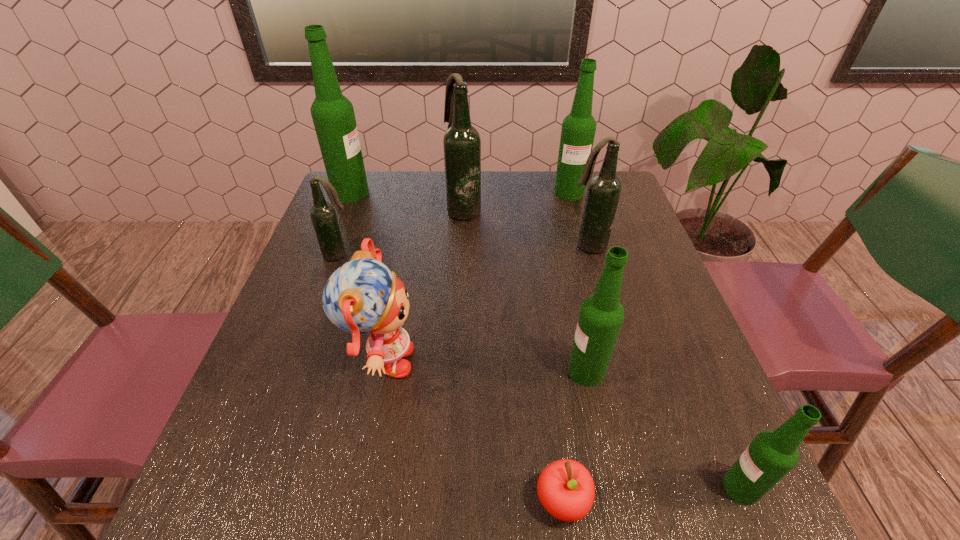
Locate an element on the screen. This screenshot has width=960, height=540. vacant space located on the label of the second nearest beer bottle is located at coordinates (454, 371).

Identify the location of vacant space located 0.250m on the face of the doll. The height and width of the screenshot is (540, 960). (544, 362).

Find the location of a particular element. blank area located 0.090m on the front of the leftmost dark beer bottle is located at coordinates (327, 288).

The width and height of the screenshot is (960, 540). Identify the location of vacant space located on the label of the rightmost green beer bottle. (603, 488).

The width and height of the screenshot is (960, 540). I want to click on free space located 0.170m on the label of the rightmost green beer bottle, so (616, 488).

You are a GUI agent. You are given a task and a screenshot of the screen. Output one action in this format:
    pyautogui.click(x=<x>, y=<y>)
    Task: Click on the vacant space situated on the label of the rightmost green beer bottle
    This screenshot has width=960, height=540.
    Given the screenshot: What is the action you would take?
    pyautogui.click(x=540, y=488)

This screenshot has width=960, height=540. In order to click on free space located 0.230m on the right of the shortest object in this screenshot , I will do `click(738, 501)`.

The height and width of the screenshot is (540, 960). Find the location of `beer bottle located at the near edge`. beer bottle located at the near edge is located at coordinates (771, 455).

Identify the location of apple located in the near edge section of the desktop. The height and width of the screenshot is (540, 960). (565, 488).

Find the location of a particular element. object that is positioned at the far left corner is located at coordinates (333, 115).